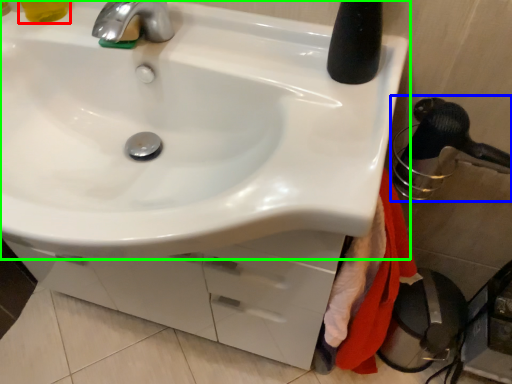
Question: Considering the real-world distances, which object is closest to liquid (highlighted by a red box)? shower (highlighted by a blue box) or sink (highlighted by a green box).

Choices:
 (A) shower
 (B) sink

Answer: (B)